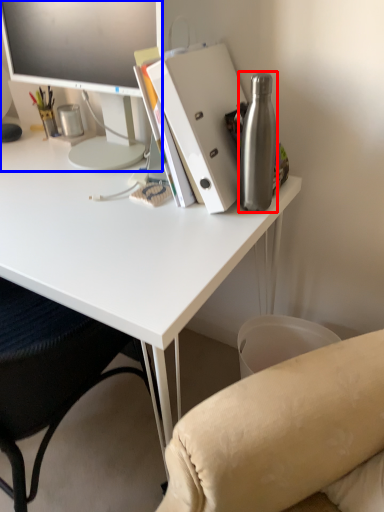
Question: Which point is further to the camera, bottle (highlighted by a red box) or television (highlighted by a blue box)?

Choices:
 (A) bottle
 (B) television

Answer: (B)